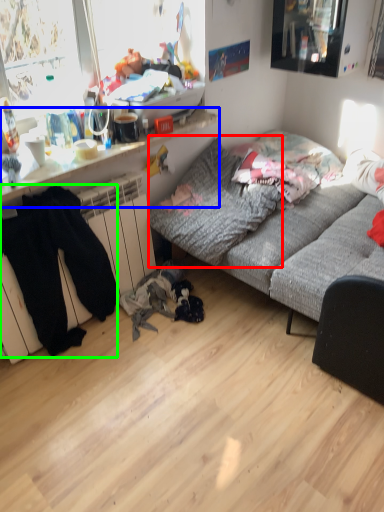
Question: Which object is positioned farthest from pillow (highlighted by a red box)? Select from desk (highlighted by a blue box) and clothing (highlighted by a green box).

Choices:
 (A) desk
 (B) clothing

Answer: (B)